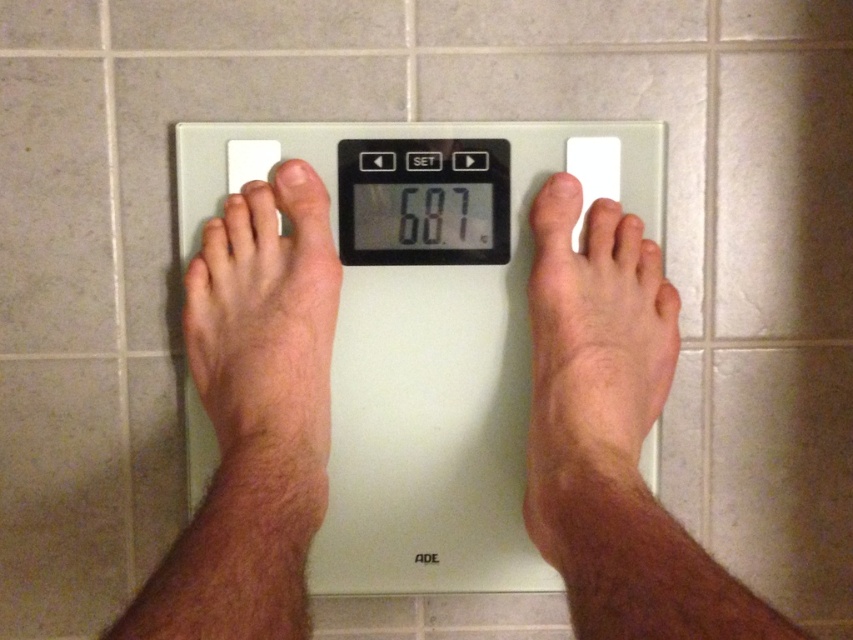
The height and width of the screenshot is (640, 853). What do you see at coordinates (427, 324) in the screenshot?
I see `white plastic scale at center` at bounding box center [427, 324].

Is white plastic scale at center closer to camera compared to skinny white foot at right?

No, white plastic scale at center is behind skinny white foot at right.

Does point (523, 220) come farther from viewer compared to point (585, 220)?

Yes.

I want to click on white plastic scale at center, so click(x=427, y=324).

Measure the distance from white plastic scale at center to hair-covered skin at center.

3.80 inches

The width and height of the screenshot is (853, 640). Find the location of `white plastic scale at center`. white plastic scale at center is located at coordinates (427, 324).

The image size is (853, 640). I want to click on white plastic scale at center, so click(427, 324).

Does skinny white foot at right appear under hair-covered skin at center?

Correct, skinny white foot at right is located below hair-covered skin at center.

Looking at this image, is skinny white foot at right thinner than hair-covered skin at center?

Incorrect, skinny white foot at right's width is not less than hair-covered skin at center's.

Who is more forward, (x=622, y=346) or (x=282, y=476)?

Point (x=282, y=476) is in front.

Where is `skinny white foot at right`? Image resolution: width=853 pixels, height=640 pixels. skinny white foot at right is located at coordinates (596, 385).